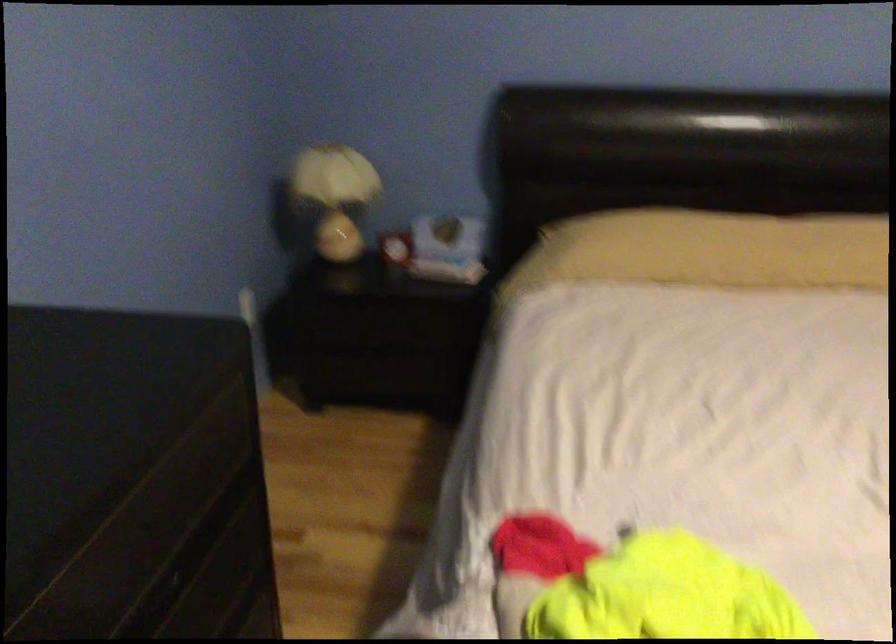
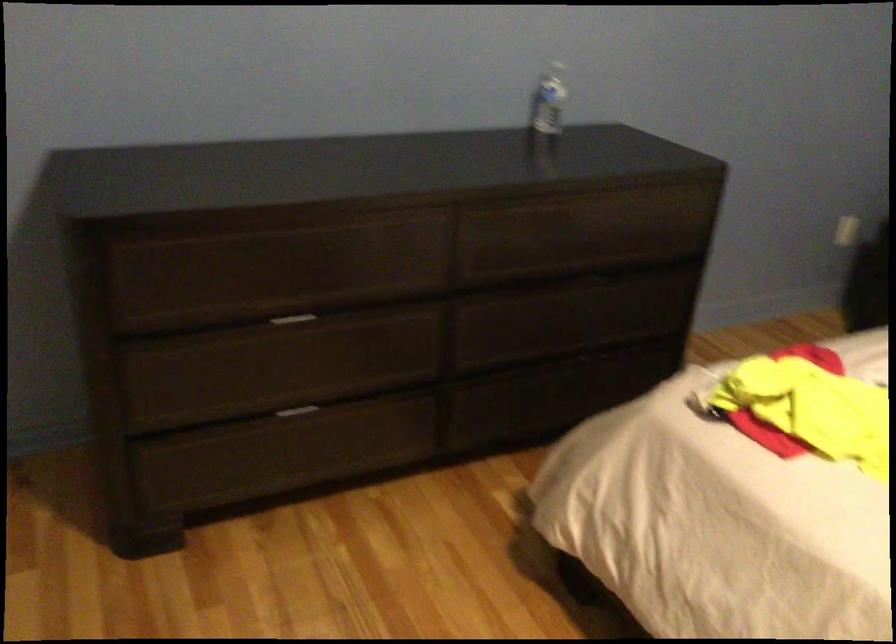
Question: The camera is either moving clockwise (left) or counter-clockwise (right) around the object. The first image is from the beginning of the video and the second image is from the end. Is the camera moving left or right when shooting the video?

Choices:
 (A) Left
 (B) Right

Answer: (B)